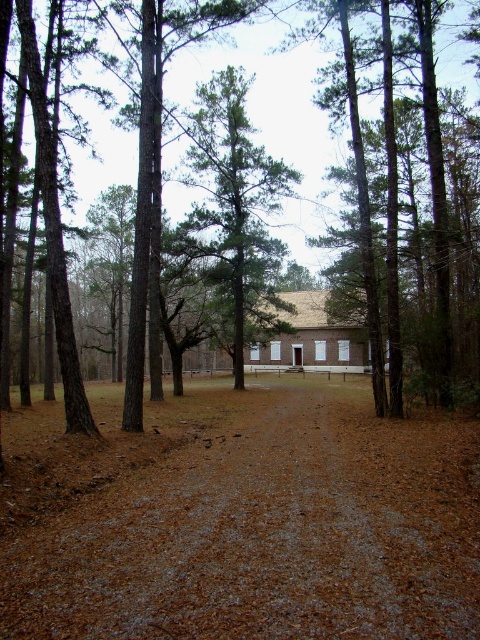
Can you confirm if brown gravel path at center is positioned above green leafy tree at center?

No.

Can you confirm if brown gravel path at center is positioned to the right of green leafy tree at center?

Indeed, brown gravel path at center is positioned on the right side of green leafy tree at center.

Who is more forward, (278, 593) or (244, 292)?

Point (278, 593) is in front.

You are a GUI agent. You are given a task and a screenshot of the screen. Output one action in this format:
    pyautogui.click(x=<x>, y=<y>)
    Task: Click on the brown gravel path at center
    The image size is (480, 640).
    Given the screenshot: What is the action you would take?
    pyautogui.click(x=240, y=518)

Does green leafy tree at center have a greater height compared to brown brick barn at center?

Yes.

Does green leafy tree at center come behind brown brick barn at center?

Yes, it is behind brown brick barn at center.

Is point (236, 83) positioned after point (311, 292)?

No, (236, 83) is in front of (311, 292).

Locate an element on the screen. Image resolution: width=480 pixels, height=640 pixels. green leafy tree at center is located at coordinates (x=233, y=214).

Between brown rough tree at center and brown brick barn at center, which one has less height?

Standing shorter between the two is brown brick barn at center.

You are a GUI agent. You are given a task and a screenshot of the screen. Output one action in this format:
    pyautogui.click(x=<x>, y=<y>)
    Task: Click on the brown rough tree at center
    
    Given the screenshot: What is the action you would take?
    pyautogui.click(x=273, y=113)

At what (x,y) coordinates should I click in order to perform the action: click on brown rough tree at center. Please return your answer as a coordinate pair (x, y). The width and height of the screenshot is (480, 640). Looking at the image, I should click on (273, 113).